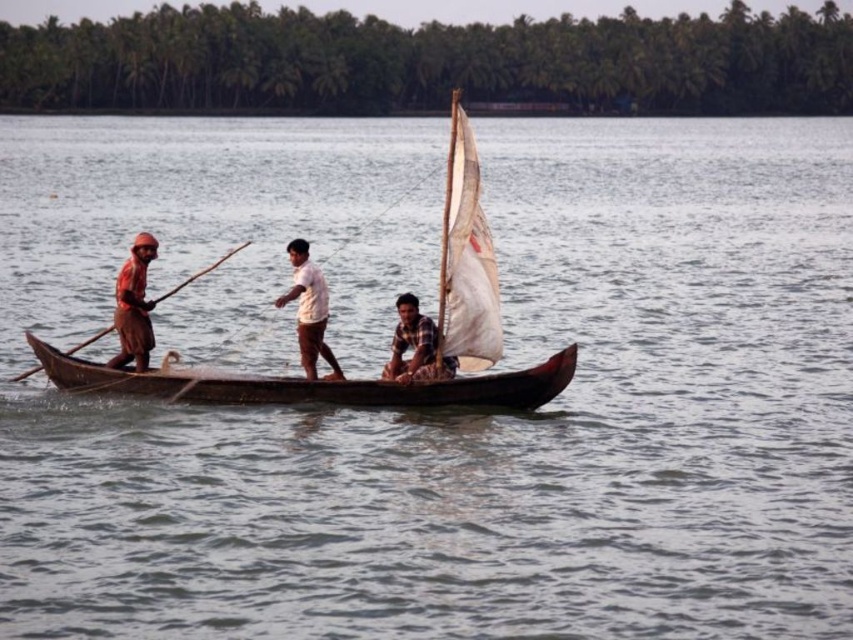
You are standing on the dock and see the wooden sailboat at center. Where is the point with coordinates point (x=309, y=384) located?

The point with coordinates point (x=309, y=384) is located on the wooden sailboat at center.

You are a photographer on the boat and want to capture both the white cotton shirt at center and the wooden paddle at left in the same frame. Which object should you zoom in on to ensure both are visible?

The white cotton shirt at center is smaller than the wooden paddle at left, so you should zoom out to include both objects in the frame.